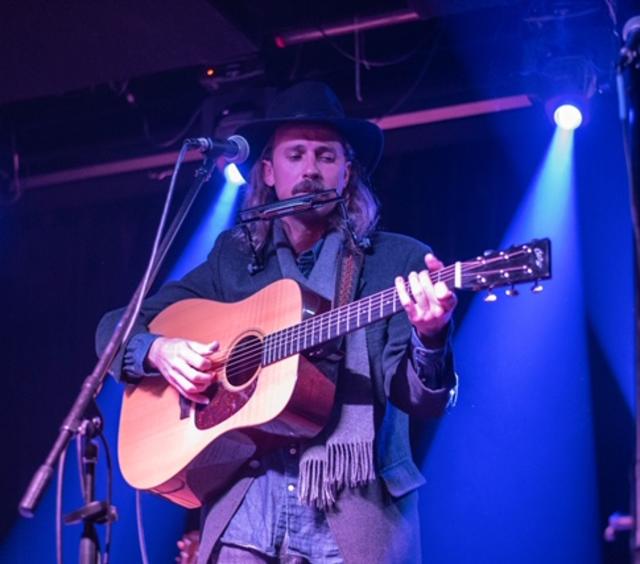
The width and height of the screenshot is (640, 564). In order to click on lighting in this screenshot , I will do `click(572, 118)`, `click(228, 177)`.